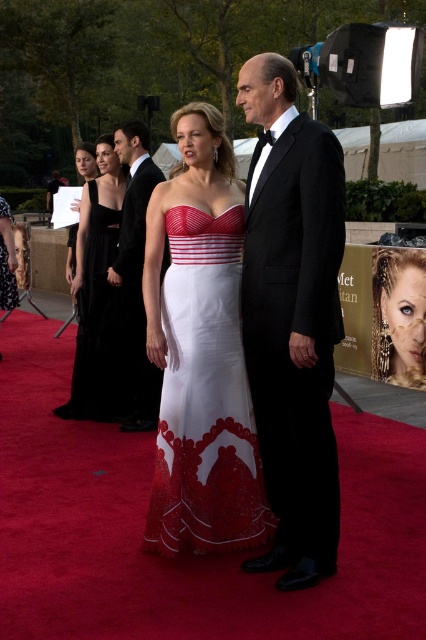
Where is `black velvet dress at left`? The width and height of the screenshot is (426, 640). black velvet dress at left is located at coordinates (97, 296).

From the picture: Is black velvet dress at left shorter than white lace dress at center?

No, black velvet dress at left is not shorter than white lace dress at center.

Where is `black velvet dress at left`? black velvet dress at left is located at coordinates (97, 296).

Where is `black velvet dress at left`? Image resolution: width=426 pixels, height=640 pixels. black velvet dress at left is located at coordinates (97, 296).

Is matte white gown at center bigger than black velvet dress at left?

Correct, matte white gown at center is larger in size than black velvet dress at left.

Which is in front, point (328, 323) or point (109, 160)?

Positioned in front is point (328, 323).

Consider the image. Who is more forward, (313, 216) or (83, 205)?

Positioned in front is point (313, 216).

Locate an element on the screen. The image size is (426, 640). matte white gown at center is located at coordinates (293, 317).

Does black satin tuxedo at center appear on the left side of black tuxedo at center?

No, black satin tuxedo at center is not to the left of black tuxedo at center.

Can you confirm if black satin tuxedo at center is wider than black tuxedo at center?

Indeed, black satin tuxedo at center has a greater width compared to black tuxedo at center.

Which is in front, point (261, 120) or point (134, 330)?

Point (261, 120) is in front.

Locate an element on the screen. This screenshot has width=426, height=640. black satin tuxedo at center is located at coordinates (293, 317).